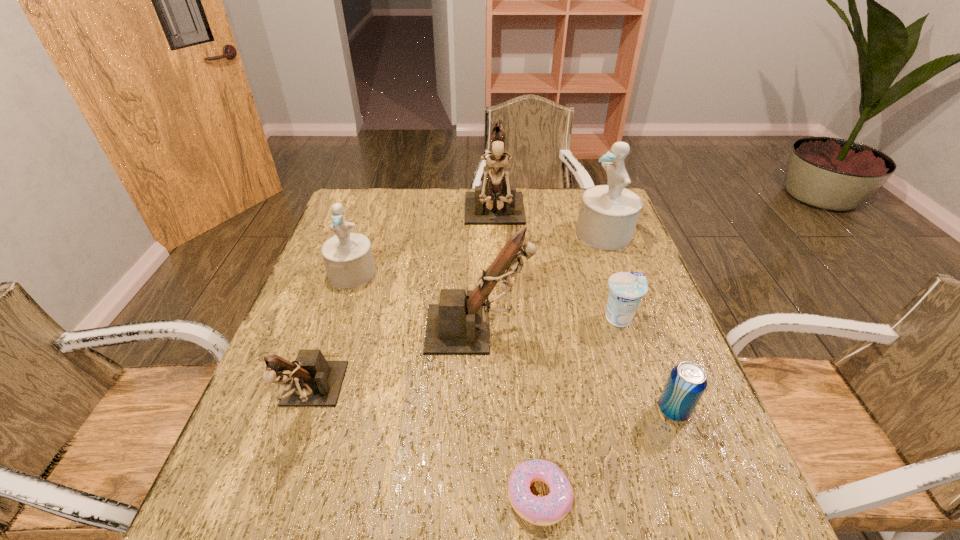
Image resolution: width=960 pixels, height=540 pixels. Identify the location of the biggest brown figurine. (495, 202).

You are a GUI agent. You are given a task and a screenshot of the screen. Output one action in this format:
    pyautogui.click(x=<x>, y=<y>)
    Task: Click on the tallest figurine
    
    Given the screenshot: What is the action you would take?
    pyautogui.click(x=495, y=202)

Identify the location of the right white figurine. (608, 214).

The image size is (960, 540). In order to click on the rightmost figurine in this screenshot , I will do `click(608, 214)`.

At what (x,y) coordinates should I click in order to perform the action: click on the second biggest brown figurine. Please return your answer as a coordinate pair (x, y). The width and height of the screenshot is (960, 540). Looking at the image, I should click on (459, 325).

Locate an element on the screen. The height and width of the screenshot is (540, 960). the second nearest figurine is located at coordinates (459, 325).

Locate an element on the screen. The height and width of the screenshot is (540, 960). the third farthest figurine is located at coordinates (348, 259).

Identify the location of the third farthest object. The width and height of the screenshot is (960, 540). (348, 259).

This screenshot has height=540, width=960. Identify the location of the leftmost brown figurine. (310, 381).

This screenshot has width=960, height=540. I want to click on the nearest figurine, so click(x=310, y=381).